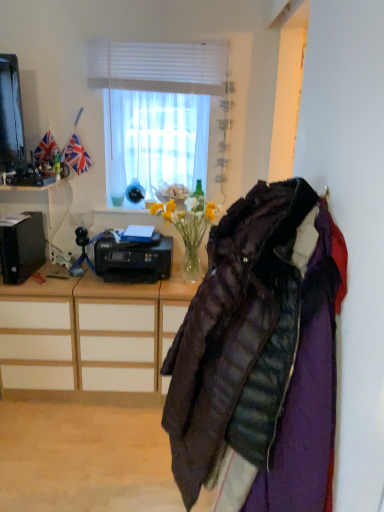
In order to click on black plastic printer at center in this screenshot , I will do `click(133, 259)`.

From a real-world perspective, is white matte window at upper center positioned above or below black plastic printer at center?

In terms of real-world spatial position, white matte window at upper center is above black plastic printer at center.

Considering the relative sizes of white matte window at upper center and black plastic printer at center in the image provided, is white matte window at upper center taller than black plastic printer at center?

Yes.

Could you tell me if white matte window at upper center is turned towards black plastic printer at center?

No, white matte window at upper center is not turned towards black plastic printer at center.

In the scene shown: Can we say white matte window at upper center lies outside black plastic printer at center?

white matte window at upper center lies outside black plastic printer at center's area.

From a real-world perspective, is wooden desk at left, the first desk when ordered from bottom to top, above or below wooden drawer at center?

In terms of real-world spatial position, wooden desk at left, the first desk when ordered from bottom to top, is above wooden drawer at center.

Does wooden desk at left, the 2th desk viewed from the top, appear on the left side of wooden drawer at center?

Yes, wooden desk at left, the 2th desk viewed from the top, is to the left of wooden drawer at center.

Are wooden desk at left, the 2th desk viewed from the top, and wooden drawer at center making contact?

There is a gap between wooden desk at left, the 2th desk viewed from the top, and wooden drawer at center.

From the image's perspective, relative to wooden drawer at center, is wooden desk at left, the first desk when ordered from bottom to top, above or below?

wooden desk at left, the first desk when ordered from bottom to top, is above wooden drawer at center.

Looking at this image, which is less distant, (128, 353) or (21, 355)?

Point (128, 353) appears to be closer to the viewer than point (21, 355).

From the image's perspective, which one is positioned lower, wooden drawer at center or wooden desk at left, the first desk when ordered from bottom to top?

wooden drawer at center, from the image's perspective.

Is wooden drawer at center positioned far away from wooden desk at left, the first desk when ordered from bottom to top?

No.

How different are the orientations of wooden drawer at center and wooden desk at left, the 2th desk viewed from the top, in degrees?

0.613 degrees.

From the image's perspective, who appears lower, wooden desk at left, the 2th desk viewed from the top, or white matte window at upper center?

wooden desk at left, the 2th desk viewed from the top.

Based on the photo, can you confirm if wooden desk at left, the first desk when ordered from bottom to top, is shorter than white matte window at upper center?

No.

Considering the sizes of objects wooden desk at left, the 2th desk viewed from the top, and white matte window at upper center in the image provided, who is wider, wooden desk at left, the 2th desk viewed from the top, or white matte window at upper center?

wooden desk at left, the 2th desk viewed from the top, is wider.

Is black plastic printer at left, the 2th desk ordered from the bottom, wider than wooden desk at left, the first desk when ordered from bottom to top?

No, black plastic printer at left, the 2th desk ordered from the bottom, is not wider than wooden desk at left, the first desk when ordered from bottom to top.

Would you say black plastic printer at left, which ranks as the first desk in top-to-bottom order, is inside or outside wooden desk at left, the 2th desk viewed from the top?

The correct answer is: outside.

From the image's perspective, is black plastic printer at left, the 2th desk ordered from the bottom, beneath wooden desk at left, the 2th desk viewed from the top?

No, from the image's perspective, black plastic printer at left, the 2th desk ordered from the bottom, is not below wooden desk at left, the 2th desk viewed from the top.

Find the location of a particular element. desk on the right of black plastic printer at left, which ranks as the first desk in top-to-bottom order is located at coordinates (38, 334).

Which object is wider, black plastic printer at left, the 2th desk ordered from the bottom, or black plastic printer at center?

Wider between the two is black plastic printer at center.

You are a GUI agent. You are given a task and a screenshot of the screen. Output one action in this format:
    pyautogui.click(x=<x>, y=<y>)
    Task: Click on the printer on the right of black plastic printer at left, which ranks as the first desk in top-to-bottom order
    This screenshot has height=512, width=384.
    Given the screenshot: What is the action you would take?
    pyautogui.click(x=133, y=259)

Looking at this image, from the image's perspective, between black plastic printer at left, which ranks as the first desk in top-to-bottom order, and black plastic printer at center, which one is located above?

From the image's view, black plastic printer at left, which ranks as the first desk in top-to-bottom order, is above.

Would you consider black plastic printer at left, which ranks as the first desk in top-to-bottom order, to be distant from black plastic printer at center?

black plastic printer at left, which ranks as the first desk in top-to-bottom order, is near black plastic printer at center, not far away.

Consider the image. Does black plastic printer at center come behind quilted dark brown jacket at right?

Yes, black plastic printer at center is further from the viewer.

I want to click on printer behind the quilted dark brown jacket at right, so click(133, 259).

Is black plastic printer at center smaller than quilted dark brown jacket at right?

Indeed, black plastic printer at center has a smaller size compared to quilted dark brown jacket at right.

Is black plastic printer at center oriented towards quilted dark brown jacket at right?

Yes, black plastic printer at center faces towards quilted dark brown jacket at right.

Identify the location of printer located underneath the white matte window at upper center (from a real-world perspective). The width and height of the screenshot is (384, 512). (133, 259).

You are a GUI agent. You are given a task and a screenshot of the screen. Output one action in this format:
    pyautogui.click(x=<x>, y=<y>)
    Task: Click on the drawer that appears on the right of wooden desk at left, the 2th desk viewed from the top
    
    Given the screenshot: What is the action you would take?
    pyautogui.click(x=117, y=344)

From the image, which object appears to be farther from white matte window at upper center, black plastic printer at center or wooden drawer at center?

wooden drawer at center.

When comparing their distances from wooden drawer at center, does wooden desk at left, the 2th desk viewed from the top, or black plastic printer at left, the 2th desk ordered from the bottom, seem closer?

wooden desk at left, the 2th desk viewed from the top, is closer to wooden drawer at center.

Looking at the image, which one is located closer to wooden drawer at center, black plastic printer at center or white matte window at upper center?

Among the two, black plastic printer at center is located nearer to wooden drawer at center.

In the scene shown: From the image, which object appears to be nearer to black plastic printer at center, wooden drawer at center or wooden desk at left, the 2th desk viewed from the top?

Among the two, wooden drawer at center is located nearer to black plastic printer at center.

Looking at the image, which one is located further to black plastic printer at left, the 2th desk ordered from the bottom, black plastic printer at center or wooden desk at left, the 2th desk viewed from the top?

black plastic printer at center is positioned further to the anchor black plastic printer at left, the 2th desk ordered from the bottom.

Based on their spatial positions, is quilted dark brown jacket at right or wooden desk at left, the first desk when ordered from bottom to top, further from black plastic printer at center?

quilted dark brown jacket at right.

Considering their positions, is quilted dark brown jacket at right positioned closer to black plastic printer at left, the 2th desk ordered from the bottom, than wooden drawer at center?

wooden drawer at center.

Based on their spatial positions, is black plastic printer at left, the 2th desk ordered from the bottom, or white matte window at upper center closer to wooden desk at left, the first desk when ordered from bottom to top?

black plastic printer at left, the 2th desk ordered from the bottom.

In order to click on drawer between quilted dark brown jacket at right and black plastic printer at center in the front-back direction in this screenshot , I will do `click(117, 344)`.

The height and width of the screenshot is (512, 384). I want to click on desk that lies between white matte window at upper center and black plastic printer at center from top to bottom, so click(x=39, y=205).

At what (x,y) coordinates should I click in order to perform the action: click on desk between white matte window at upper center and wooden desk at left, the first desk when ordered from bottom to top, in the vertical direction. Please return your answer as a coordinate pair (x, y). The image size is (384, 512). Looking at the image, I should click on (39, 205).

This screenshot has width=384, height=512. I want to click on printer between black plastic printer at left, the 2th desk ordered from the bottom, and wooden drawer at center in the up-down direction, so click(x=133, y=259).